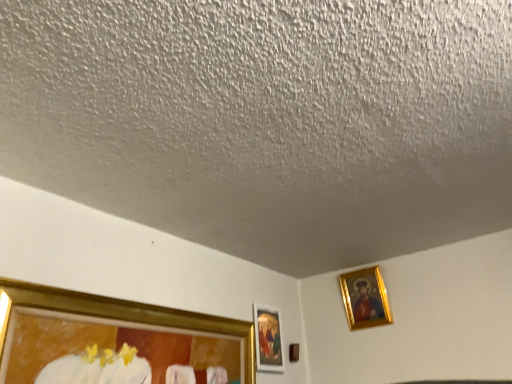
Question: Which direction should I rotate to look at gold-framed painting at center, which appears as the 1th picture frame when viewed from the left, — up or down?

Choices:
 (A) down
 (B) up

Answer: (A)

Question: From a real-world perspective, is brown wooden picture frame at lower center, arranged as the second picture frame when viewed from the right, beneath gold-framed painting at center, which ranks as the third picture frame in right-to-left order?

Choices:
 (A) no
 (B) yes

Answer: (B)

Question: Is brown wooden picture frame at lower center, arranged as the second picture frame when viewed from the right, turned away from gold-framed painting at center, which ranks as the third picture frame in right-to-left order?

Choices:
 (A) no
 (B) yes

Answer: (A)

Question: Considering the relative sizes of brown wooden picture frame at lower center, the second picture frame in the left-to-right sequence, and gold-framed painting at center, which appears as the 1th picture frame when viewed from the left, in the image provided, is brown wooden picture frame at lower center, the second picture frame in the left-to-right sequence, bigger than gold-framed painting at center, which appears as the 1th picture frame when viewed from the left,?

Choices:
 (A) yes
 (B) no

Answer: (B)

Question: Can you confirm if brown wooden picture frame at lower center, the second picture frame in the left-to-right sequence, is shorter than gold-framed painting at center, which appears as the 1th picture frame when viewed from the left?

Choices:
 (A) yes
 (B) no

Answer: (A)

Question: Is brown wooden picture frame at lower center, arranged as the second picture frame when viewed from the right, facing towards gold-framed painting at center, which appears as the 1th picture frame when viewed from the left?

Choices:
 (A) yes
 (B) no

Answer: (B)

Question: Can you confirm if brown wooden picture frame at lower center, the second picture frame in the left-to-right sequence, is taller than gold-framed painting at center, which ranks as the third picture frame in right-to-left order?

Choices:
 (A) yes
 (B) no

Answer: (B)

Question: Is gold metallic picture frame at upper right, positioned as the 1th picture frame in right-to-left order, closer to the viewer compared to gold-framed painting at center, which appears as the 1th picture frame when viewed from the left?

Choices:
 (A) no
 (B) yes

Answer: (A)

Question: Can you confirm if gold metallic picture frame at upper right, positioned as the third picture frame in left-to-right order, is taller than gold-framed painting at center, which appears as the 1th picture frame when viewed from the left?

Choices:
 (A) yes
 (B) no

Answer: (A)

Question: Is gold-framed painting at center, which ranks as the third picture frame in right-to-left order, at the back of gold metallic picture frame at upper right, positioned as the 1th picture frame in right-to-left order?

Choices:
 (A) yes
 (B) no

Answer: (B)

Question: From the image's perspective, is gold metallic picture frame at upper right, positioned as the 1th picture frame in right-to-left order, below gold-framed painting at center, which appears as the 1th picture frame when viewed from the left?

Choices:
 (A) yes
 (B) no

Answer: (B)

Question: Considering the relative sizes of gold metallic picture frame at upper right, positioned as the third picture frame in left-to-right order, and gold-framed painting at center, which ranks as the third picture frame in right-to-left order, in the image provided, is gold metallic picture frame at upper right, positioned as the third picture frame in left-to-right order, shorter than gold-framed painting at center, which ranks as the third picture frame in right-to-left order,?

Choices:
 (A) no
 (B) yes

Answer: (A)

Question: Does gold metallic picture frame at upper right, positioned as the third picture frame in left-to-right order, have a larger size compared to gold-framed painting at center, which appears as the 1th picture frame when viewed from the left?

Choices:
 (A) yes
 (B) no

Answer: (A)

Question: Is gold metallic picture frame at upper right, positioned as the 1th picture frame in right-to-left order, facing towards brown wooden picture frame at lower center, arranged as the second picture frame when viewed from the right?

Choices:
 (A) yes
 (B) no

Answer: (B)